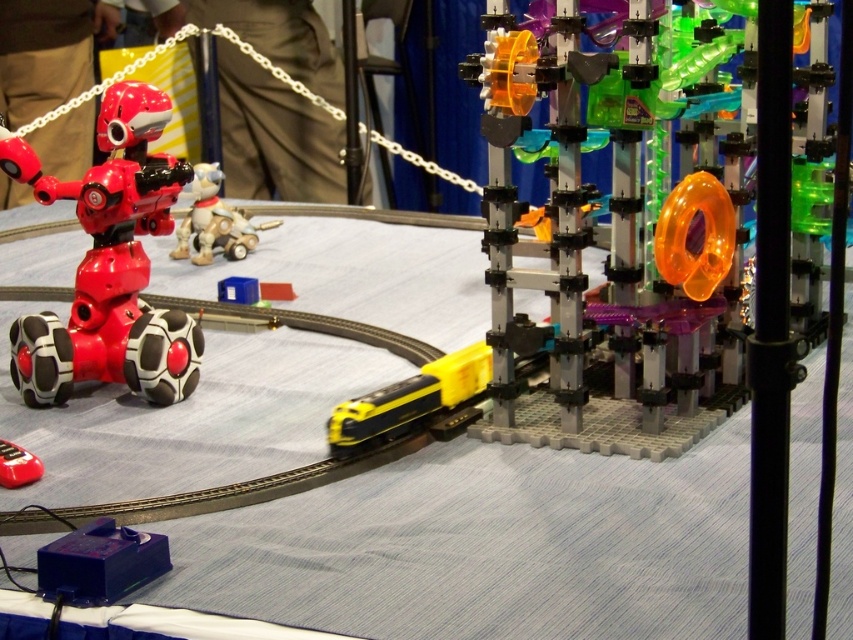
You are a child who wants to control the shiny red robot at left using the shiny red remote control at lower left. Since both are red, you might get confused. Based on their positions, which object is closer to the center of the table?

The shiny red robot at left is to the right of the shiny red remote control at lower left, so the robot is closer to the center of the table than the remote control.

From the picture: You are an observer looking at the toy train and robotic display on the table. You notice the translucent orange plastic gear at center and the plush white dog at center. Which object is positioned to the right of the other?

The translucent orange plastic gear at center is to the right of the plush white dog at center.